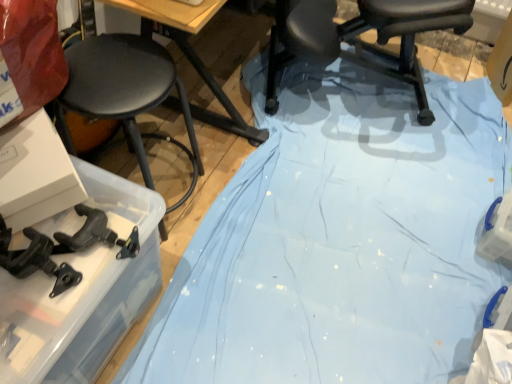
Question: From a real-world perspective, is black plastic chair at center positioned over wooden at upper center based on gravity?

Choices:
 (A) no
 (B) yes

Answer: (A)

Question: From a real-world perspective, is black plastic chair at center located beneath wooden at upper center?

Choices:
 (A) no
 (B) yes

Answer: (B)

Question: From the image's perspective, is black plastic chair at center located above wooden at upper center?

Choices:
 (A) no
 (B) yes

Answer: (B)

Question: Is black plastic chair at center facing away from wooden at upper center?

Choices:
 (A) yes
 (B) no

Answer: (B)

Question: Considering the relative sizes of black plastic chair at center and wooden at upper center in the image provided, is black plastic chair at center taller than wooden at upper center?

Choices:
 (A) no
 (B) yes

Answer: (B)

Question: Considering the positions of wooden at upper center and black matte stool at left in the image, is wooden at upper center wider or thinner than black matte stool at left?

Choices:
 (A) thin
 (B) wide

Answer: (A)

Question: From their relative heights in the image, would you say wooden at upper center is taller or shorter than black matte stool at left?

Choices:
 (A) tall
 (B) short

Answer: (B)

Question: Is wooden at upper center in front of or behind black matte stool at left in the image?

Choices:
 (A) front
 (B) behind

Answer: (B)

Question: Is wooden at upper center inside the boundaries of black matte stool at left, or outside?

Choices:
 (A) inside
 (B) outside

Answer: (B)

Question: Is wooden at upper center in front of or behind black plastic chair at center in the image?

Choices:
 (A) front
 (B) behind

Answer: (A)

Question: From a real-world perspective, is wooden at upper center positioned above or below black plastic chair at center?

Choices:
 (A) above
 (B) below

Answer: (A)

Question: From their relative heights in the image, would you say wooden at upper center is taller or shorter than black plastic chair at center?

Choices:
 (A) tall
 (B) short

Answer: (B)

Question: From the image's perspective, is wooden at upper center located above or below black plastic chair at center?

Choices:
 (A) above
 (B) below

Answer: (B)

Question: Does point (79, 99) appear closer or farther from the camera than point (313, 23)?

Choices:
 (A) closer
 (B) farther

Answer: (A)

Question: Is black matte stool at left wider or thinner than black plastic chair at center?

Choices:
 (A) thin
 (B) wide

Answer: (A)